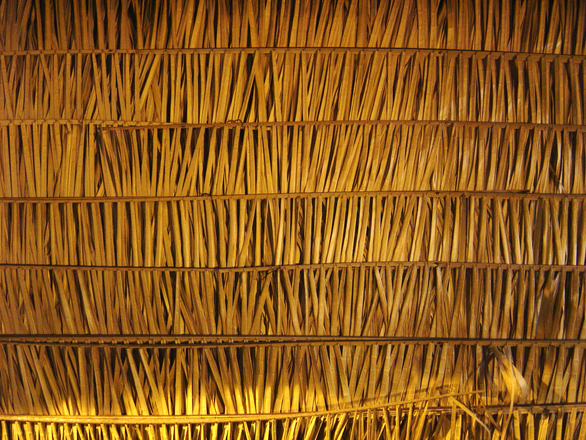
Locate an element on the screen. This screenshot has height=440, width=586. woven raffia bands is located at coordinates (x=459, y=15), (x=425, y=72), (x=403, y=157), (x=389, y=227), (x=374, y=291), (x=329, y=372), (x=316, y=433).